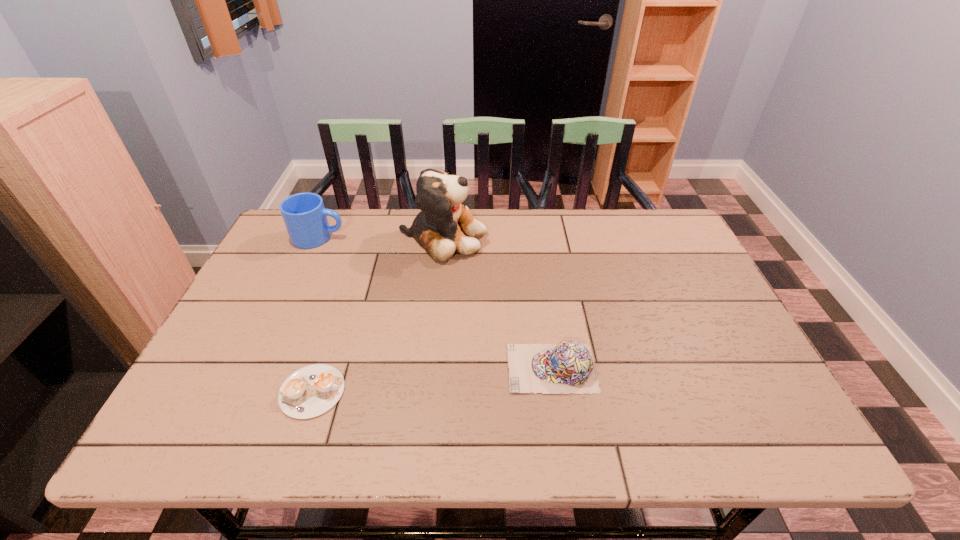
The width and height of the screenshot is (960, 540). Find the location of `free space located 0.100m on the front, side, and top of the second shortest object`. free space located 0.100m on the front, side, and top of the second shortest object is located at coordinates (464, 368).

Image resolution: width=960 pixels, height=540 pixels. Find the location of `vacant space located on the right of the cappuccino`. vacant space located on the right of the cappuccino is located at coordinates (523, 391).

Find the location of a particular element. The image size is (960, 540). puppy that is positioned at the far edge is located at coordinates (445, 225).

You are a GUI agent. You are given a task and a screenshot of the screen. Output one action in this format:
    pyautogui.click(x=<x>, y=<y>)
    Task: Click on the mug that is at the far edge
    The height and width of the screenshot is (540, 960).
    Given the screenshot: What is the action you would take?
    pyautogui.click(x=305, y=217)

Image resolution: width=960 pixels, height=540 pixels. Identify the location of object that is at the near edge. (311, 391).

Locate an element on the screen. object at the left edge is located at coordinates (305, 217).

Identify the location of object that is positioned at the far left corner. (305, 217).

At what (x,y) coordinates should I click in order to perform the action: click on vacant space at the far edge of the desktop. Please return your answer as a coordinate pair (x, y). This screenshot has height=540, width=960. Looking at the image, I should click on (364, 216).

The height and width of the screenshot is (540, 960). Identify the location of blank area at the near edge. (540, 428).

Locate an element on the screen. free location at the left edge is located at coordinates (x=260, y=296).